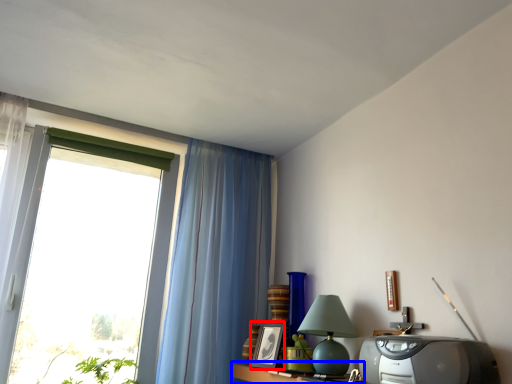
Question: Which object appears farthest to the camera in this image, picture frame (highlighted by a red box) or table (highlighted by a blue box)?

Choices:
 (A) picture frame
 (B) table

Answer: (A)